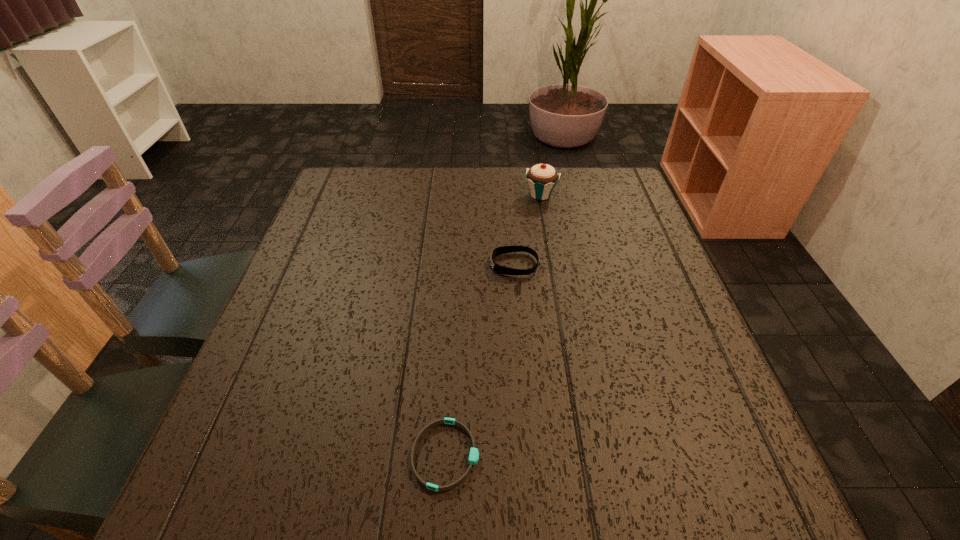
Where is `vacant space situated on the buckle of the nearest object`? vacant space situated on the buckle of the nearest object is located at coordinates (583, 455).

Where is `object present at the far edge`? The image size is (960, 540). object present at the far edge is located at coordinates (542, 178).

Where is `object located in the near edge section of the desktop`? This screenshot has width=960, height=540. object located in the near edge section of the desktop is located at coordinates (474, 454).

Image resolution: width=960 pixels, height=540 pixels. I want to click on vacant space at the far edge of the desktop, so click(x=524, y=201).

Image resolution: width=960 pixels, height=540 pixels. I want to click on free spot at the near edge of the desktop, so click(x=571, y=506).

Locate an element on the screen. free space at the left edge of the desktop is located at coordinates (226, 417).

In the image, there is a desktop. In order to click on blank space at the right edge in this screenshot , I will do `click(653, 292)`.

At what (x,y) coordinates should I click in order to perform the action: click on vacant area at the far left corner of the desktop. Please return your answer as a coordinate pair (x, y). Looking at the image, I should click on (358, 183).

Find the location of a particular element. The height and width of the screenshot is (540, 960). vacant area at the near left corner of the desktop is located at coordinates (239, 509).

In the image, there is a desktop. Identify the location of vacant region at the far right corner. The height and width of the screenshot is (540, 960). (601, 192).